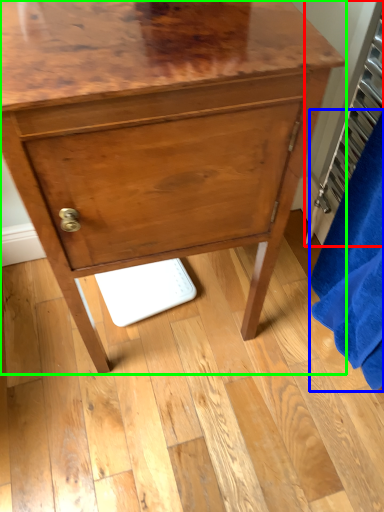
Question: Which is nearer to the radiator (highlighted by a red box)? bath towel (highlighted by a blue box) or chest of drawers (highlighted by a green box).

Choices:
 (A) bath towel
 (B) chest of drawers

Answer: (A)